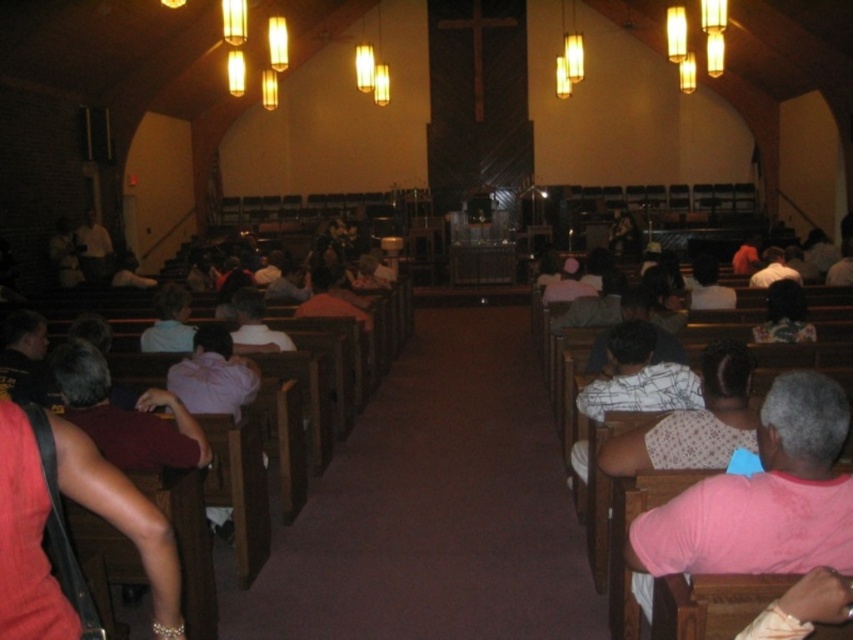
Who is more distant from viewer, (177, 579) or (788, 291)?

Positioned behind is point (788, 291).

Can you confirm if pink fabric shirt at left is positioned above pink fabric shirt at right?

Incorrect, pink fabric shirt at left is not positioned above pink fabric shirt at right.

Identify the location of pink fabric shirt at left. Image resolution: width=853 pixels, height=640 pixels. (26, 540).